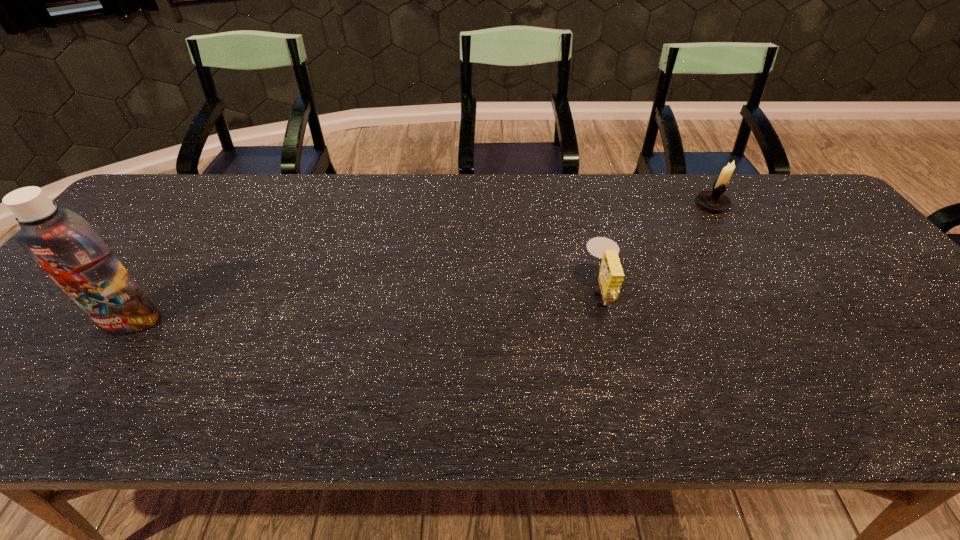
What are the coordinates of `free space located on the front-facing side of the sponge` in the screenshot? It's located at [x=475, y=292].

What are the coordinates of `object that is at the far edge` in the screenshot? It's located at (715, 200).

At what (x,y) coordinates should I click in order to perform the action: click on object that is at the left edge. Please return your answer as a coordinate pair (x, y). The height and width of the screenshot is (540, 960). Looking at the image, I should click on (64, 244).

Find the location of a particular element. This screenshot has width=960, height=540. vacant region at the far edge of the desktop is located at coordinates (304, 188).

Locate an element on the screen. The image size is (960, 540). vacant space at the near edge is located at coordinates (818, 420).

Find the location of a particular element. The image size is (960, 540). free space at the right edge is located at coordinates (858, 260).

At what (x,y) coordinates should I click in order to perform the action: click on vacant area at the far left corner of the desktop. Please return your answer as a coordinate pair (x, y). Looking at the image, I should click on (142, 195).

You are a GUI agent. You are given a task and a screenshot of the screen. Output one action in this format:
    pyautogui.click(x=<x>, y=<y>)
    Task: Click on the free space between the shortest object and the tallest object
    This screenshot has height=540, width=960.
    Given the screenshot: What is the action you would take?
    coord(366,306)

Where is `empty space between the leftmost object and the second tallest object`? The image size is (960, 540). empty space between the leftmost object and the second tallest object is located at coordinates (421, 262).

In order to click on vacant region between the sponge and the candle holder in this screenshot , I will do `click(657, 248)`.